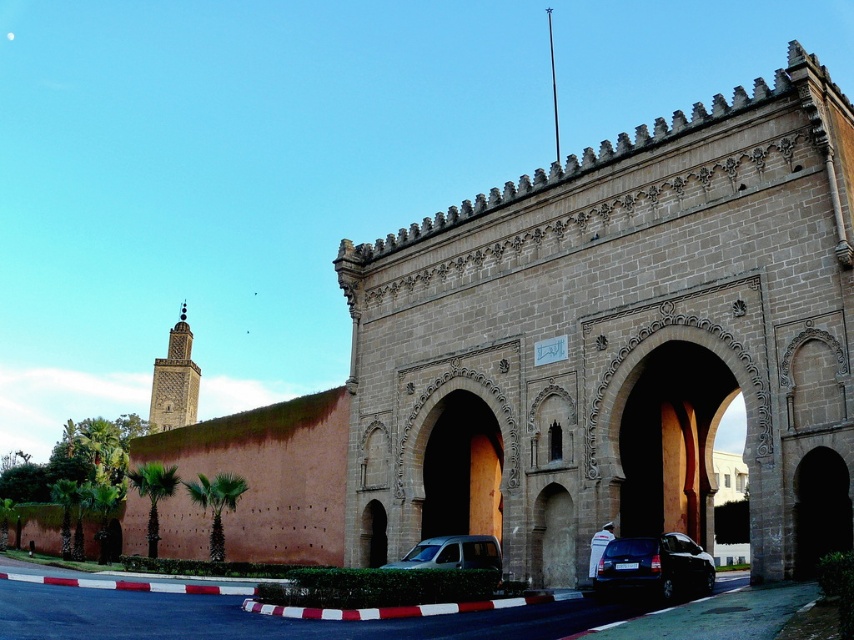
Question: In this image, where is brown stone archway at center located relative to metallic silver van at center?

Choices:
 (A) left
 (B) right

Answer: (A)

Question: Which point is farther to the camera?

Choices:
 (A) metallic silver van at center
 (B) wooden archway at center
 (C) brown stone archway at center

Answer: (A)

Question: Based on their relative distances, which object is farther from the wooden archway at center?

Choices:
 (A) shiny black sedan at lower center
 (B) dark brown stone minaret at upper left
 (C) brown stone archway at center
 (D) metallic silver van at center

Answer: (B)

Question: Which of the following is the farthest from the observer?

Choices:
 (A) (457, 545)
 (B) (664, 577)
 (C) (699, 406)
 (D) (823, 113)

Answer: (C)

Question: Does dark brown stone minaret at upper left have a smaller size compared to metallic silver van at center?

Choices:
 (A) yes
 (B) no

Answer: (B)

Question: Can you confirm if wooden archway at center is positioned to the right of shiny black sedan at lower center?

Choices:
 (A) no
 (B) yes

Answer: (B)